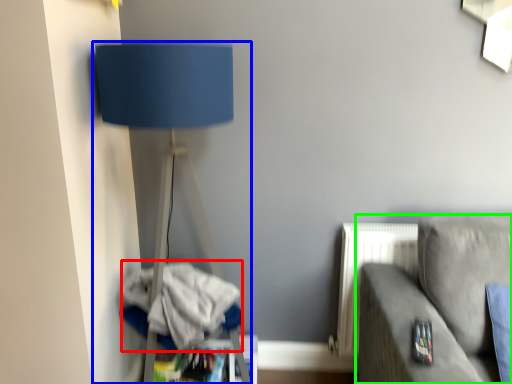
Question: Based on their relative distances, which object is farther from laundry (highlighted by a red box)? Choose from lamp (highlighted by a blue box) and studio couch (highlighted by a green box).

Choices:
 (A) lamp
 (B) studio couch

Answer: (B)